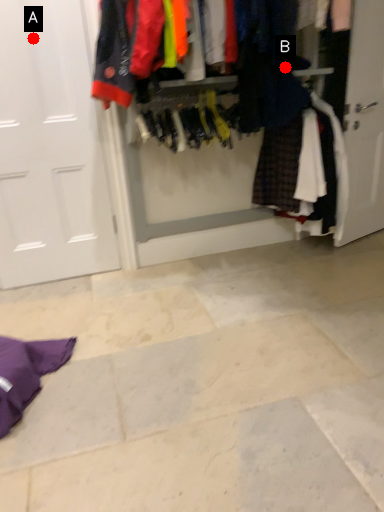
Question: Two points are circled on the image, labeled by A and B beside each circle. Which point is further to the camera?

Choices:
 (A) A is further
 (B) B is further

Answer: (B)